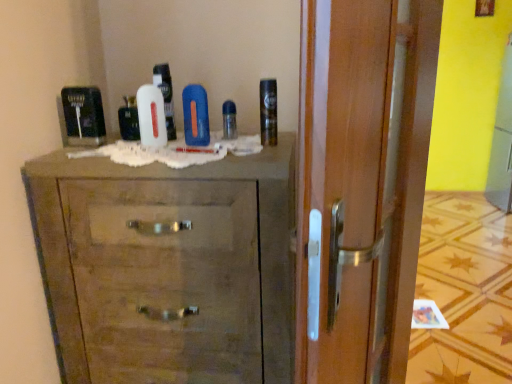
Identify the location of free region on the left part of white matte shaving cream at center, the 2th shaving cream positioned from the right. (111, 141).